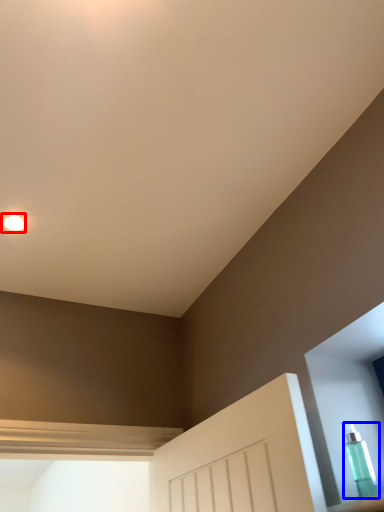
Question: Which object appears closest to the camera in this image, droplight (highlighted by a red box) or bottle (highlighted by a blue box)?

Choices:
 (A) droplight
 (B) bottle

Answer: (B)